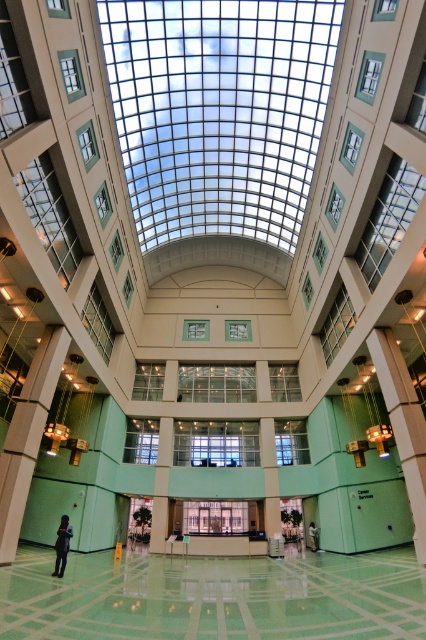
Which is more to the left, green polished concrete floor at lower center or dark blue jeans at lower left?

Positioned to the left is dark blue jeans at lower left.

Is green polished concrete floor at lower center further to camera compared to dark blue jeans at lower left?

No.

Where is `green polished concrete floor at lower center`? The image size is (426, 640). green polished concrete floor at lower center is located at coordinates (213, 596).

Who is shorter, dark blue jeans at lower left or light brown leather jacket at lower center?

light brown leather jacket at lower center is shorter.

Can you confirm if dark blue jeans at lower left is positioned to the right of light brown leather jacket at lower center?

No, dark blue jeans at lower left is not to the right of light brown leather jacket at lower center.

Find the location of `dark blue jeans at lower left`. dark blue jeans at lower left is located at coordinates (62, 545).

Is point (259, 572) farther from camera compared to point (313, 536)?

No.

Where is `green polished concrete floor at lower center`? This screenshot has width=426, height=640. green polished concrete floor at lower center is located at coordinates (213, 596).

Find the location of a particular element. Image resolution: width=426 pixels, height=640 pixels. green polished concrete floor at lower center is located at coordinates (213, 596).